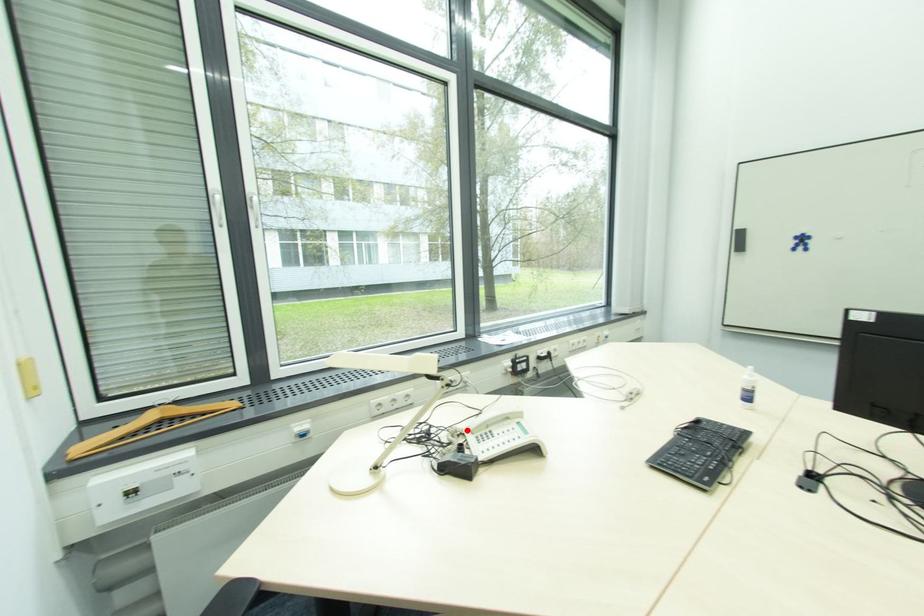
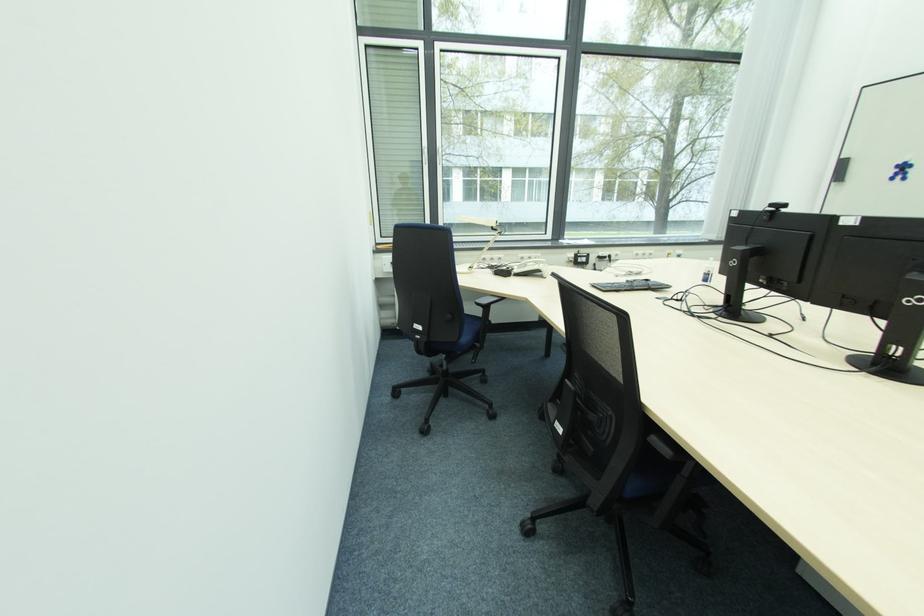
Question: I am providing you with two images of the same scene from different viewpoints. In image1, a red point is highlighted. Considering the same 3D point in image2, which of the following is correct?

Choices:
 (A) It is closer
 (B) It is farther

Answer: (B)